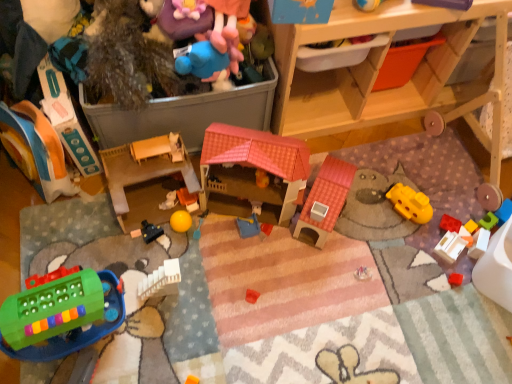
The image size is (512, 384). Identify the location of white matte block at lower right, positioned as the second toy in right-to-left order. (479, 243).

Identify the location of blue plastic toy at center, the ninth toy positioned from the left. (248, 226).

What do you see at coordinates (450, 247) in the screenshot? I see `white plastic toy at lower right, which is counted as the tenth toy, starting from the left` at bounding box center [450, 247].

Find the location of a particular element. Image resolution: width=512 pixels, height=384 pixels. matte plastic toy at left, the second toy viewed from the left is located at coordinates (66, 118).

Measure the distance between point (199,69) and camera.

Point (199,69) and camera are 1.22 meters apart from each other.

The height and width of the screenshot is (384, 512). Describe the element at coordinates (200, 60) in the screenshot. I see `blue plush toy at upper center, the sixth toy positioned from the right` at that location.

Where is `wooden dollhouse at center-left, the tenth toy viewed from the right`? This screenshot has height=384, width=512. wooden dollhouse at center-left, the tenth toy viewed from the right is located at coordinates (145, 167).

This screenshot has height=384, width=512. What do you see at coordinates (145, 167) in the screenshot?
I see `wooden dollhouse at center-left, the 4th toy from the left` at bounding box center [145, 167].

In order to click on smooth orange ball at center, which is the seventh toy in right-to-left order in this screenshot , I will do `click(188, 199)`.

From the image's perspective, which is below, green plastic building block at lower left, positioned as the 11th toy in right-to-left order, or wooden dollhouse at center-left, the 4th toy from the left?

green plastic building block at lower left, positioned as the 11th toy in right-to-left order, appears lower in the image.

Considering the relative sizes of green plastic building block at lower left, which is the 3th toy in left-to-right order, and wooden dollhouse at center-left, the 4th toy from the left, in the image provided, is green plastic building block at lower left, which is the 3th toy in left-to-right order, smaller than wooden dollhouse at center-left, the 4th toy from the left,?

Indeed, green plastic building block at lower left, which is the 3th toy in left-to-right order, has a smaller size compared to wooden dollhouse at center-left, the 4th toy from the left.

Does green plastic building block at lower left, which is the 3th toy in left-to-right order, have a lesser width compared to wooden dollhouse at center-left, the 4th toy from the left?

In fact, green plastic building block at lower left, which is the 3th toy in left-to-right order, might be wider than wooden dollhouse at center-left, the 4th toy from the left.

From a real-world perspective, starting from the green plastic building block at lower left, which is the 3th toy in left-to-right order, which toy is the 1st one below it? Please provide its 2D coordinates.

[(145, 167)]

Does wooden cabinet at upper right have a smaller size compared to matte plastic toy at left, the first toy when ordered from left to right?

Incorrect, wooden cabinet at upper right is not smaller in size than matte plastic toy at left, the first toy when ordered from left to right.

From a real-world perspective, which object rests below the other?

From a 3D spatial view, matte plastic toy at left, positioned as the 13th toy in right-to-left order, is below.

Is wooden cabinet at upper right positioned with its back to matte plastic toy at left, positioned as the 13th toy in right-to-left order?

No, wooden cabinet at upper right is not facing the opposite direction of matte plastic toy at left, positioned as the 13th toy in right-to-left order.

Is wooden cabinet at upper right not near matte plastic toy at left, positioned as the 13th toy in right-to-left order?

No, wooden cabinet at upper right is in close proximity to matte plastic toy at left, positioned as the 13th toy in right-to-left order.

From a real-world perspective, which toy is the 4th one above the white plastic toy at lower right, which is counted as the tenth toy, starting from the left? Please provide its 2D coordinates.

[(169, 201)]

Is smooth plastic toy at center, the ninth toy viewed from the right, facing towards white plastic toy at lower right, positioned as the 4th toy in right-to-left order?

No.

Consider the image. In the image, is smooth plastic toy at center, the ninth toy viewed from the right, on the left side or the right side of white plastic toy at lower right, which is counted as the tenth toy, starting from the left?

From the image, it's evident that smooth plastic toy at center, the ninth toy viewed from the right, is to the left of white plastic toy at lower right, which is counted as the tenth toy, starting from the left.

Looking at this image, can you see smooth plastic toy at center, arranged as the 5th toy when viewed from the left, touching white plastic toy at lower right, positioned as the 4th toy in right-to-left order?

No, smooth plastic toy at center, arranged as the 5th toy when viewed from the left, is not with white plastic toy at lower right, positioned as the 4th toy in right-to-left order.

Identify the location of the 7th toy in front when counting from the smooth orange ball at center, positioned as the 7th toy in left-to-right order. The width and height of the screenshot is (512, 384). click(x=145, y=167).

Is wooden dollhouse at center-left, the tenth toy viewed from the right, placed right next to smooth orange ball at center, positioned as the 7th toy in left-to-right order?

No, wooden dollhouse at center-left, the tenth toy viewed from the right, is not in contact with smooth orange ball at center, positioned as the 7th toy in left-to-right order.

Is wooden dollhouse at center-left, the tenth toy viewed from the right, wider than smooth orange ball at center, which is the seventh toy in right-to-left order?

Yes.

Considering the relative sizes of wooden dollhouse at center-left, the 4th toy from the left, and smooth orange ball at center, positioned as the 7th toy in left-to-right order, in the image provided, is wooden dollhouse at center-left, the 4th toy from the left, bigger than smooth orange ball at center, positioned as the 7th toy in left-to-right order,?

Yes.

Is blue plastic toy at center, the ninth toy positioned from the left, wider than matte plastic toy at left, the first toy when ordered from left to right?

No.

From the image's perspective, is blue plastic toy at center, which is the fifth toy from right to left, located above matte plastic toy at left, positioned as the 13th toy in right-to-left order?

Actually, blue plastic toy at center, which is the fifth toy from right to left, appears below matte plastic toy at left, positioned as the 13th toy in right-to-left order, in the image.

Is point (252, 229) closer or farther from the camera than point (28, 144)?

Point (252, 229) appears to be farther away from the viewer than point (28, 144).

From a real-world perspective, is blue plastic toy at center, which is the fifth toy from right to left, over matte plastic toy at left, the first toy when ordered from left to right?

No, from a real-world perspective, blue plastic toy at center, which is the fifth toy from right to left, is not over matte plastic toy at left, the first toy when ordered from left to right

Is white matte block at lower right, positioned as the second toy in right-to-left order, shorter than translucent plastic cube at center, which is counted as the 13th toy, starting from the left?

No.

Is white matte block at lower right, positioned as the second toy in right-to-left order, bigger or smaller than translucent plastic cube at center, which is counted as the 13th toy, starting from the left?

In the image, white matte block at lower right, positioned as the second toy in right-to-left order, appears to be larger than translucent plastic cube at center, which is counted as the 13th toy, starting from the left.

Is white matte block at lower right, which is the 12th toy in left-to-right order, to the left or to the right of translucent plastic cube at center, the first toy when ordered from right to left, in the image?

Based on their positions, white matte block at lower right, which is the 12th toy in left-to-right order, is located to the left of translucent plastic cube at center, the first toy when ordered from right to left.

From a real-world perspective, between yellow rubber ball at center, the 6th toy from the left, and blue plastic toy at center, the ninth toy positioned from the left, who is vertically higher?

yellow rubber ball at center, the 6th toy from the left, is physically above.

Which is behind, point (186, 228) or point (244, 225)?

The point (244, 225) is farther.

This screenshot has height=384, width=512. I want to click on toy that is the 1st object directly below the green plastic building block at lower left, which is the 3th toy in left-to-right order (from a real-world perspective), so click(x=145, y=167).

Which toy is the 9th one when counting from the left side of the wooden cabinet at upper right? Please provide its 2D coordinates.

[(37, 150)]

Which object lies further to the anchor point smooth orange ball at center, which is the seventh toy in right-to-left order, yellow rubber ball at center, the 6th toy from the left, or blue plastic toy at center, the ninth toy positioned from the left?

The object further to smooth orange ball at center, which is the seventh toy in right-to-left order, is blue plastic toy at center, the ninth toy positioned from the left.

Looking at the image, which one is located closer to matte plastic toy at left, positioned as the 13th toy in right-to-left order, white matte block at lower right, positioned as the second toy in right-to-left order, or green plastic building block at lower left, which is the 3th toy in left-to-right order?

green plastic building block at lower left, which is the 3th toy in left-to-right order, lies closer to matte plastic toy at left, positioned as the 13th toy in right-to-left order, than the other object.

Based on their spatial positions, is blue plastic toy at center, which is the fifth toy from right to left, or translucent plastic cube at center, the first toy when ordered from right to left, closer to smooth orange ball at center, positioned as the 7th toy in left-to-right order?

blue plastic toy at center, which is the fifth toy from right to left, lies closer to smooth orange ball at center, positioned as the 7th toy in left-to-right order, than the other object.

Based on their spatial positions, is wooden cabinet at upper right or translucent plastic cube at center, which is counted as the 13th toy, starting from the left, further from wooden dollhouse at center-left, the tenth toy viewed from the right?

translucent plastic cube at center, which is counted as the 13th toy, starting from the left, lies further to wooden dollhouse at center-left, the tenth toy viewed from the right, than the other object.

In the scene shown: Considering their positions, is smooth plastic toy at center, the ninth toy viewed from the right, positioned closer to translucent plastic cube at center, which is counted as the 13th toy, starting from the left, than green plastic building block at lower left, which is the 3th toy in left-to-right order?

The object closer to translucent plastic cube at center, which is counted as the 13th toy, starting from the left, is smooth plastic toy at center, the ninth toy viewed from the right.

Looking at the image, which one is located closer to matte plastic toy at left, the second toy viewed from the left, wooden cabinet at upper right or blue plush toy at upper center, which is the eighth toy in left-to-right order?

The object closer to matte plastic toy at left, the second toy viewed from the left, is blue plush toy at upper center, which is the eighth toy in left-to-right order.

Considering their positions, is white matte block at lower right, which is the 12th toy in left-to-right order, positioned closer to blue plush toy at upper center, the sixth toy positioned from the right, than matte plastic toy at left, positioned as the 13th toy in right-to-left order?

matte plastic toy at left, positioned as the 13th toy in right-to-left order.

Estimate the real-world distances between objects in this image. Which object is further from translucent orange cube at center, which ranks as the eleventh toy in left-to-right order, blue plastic toy at center, the ninth toy positioned from the left, or wooden cabinet at upper right?

blue plastic toy at center, the ninth toy positioned from the left, is positioned further to the anchor translucent orange cube at center, which ranks as the eleventh toy in left-to-right order.

At what (x,y) coordinates should I click in order to perform the action: click on cabinetry between blue plush toy at upper center, the sixth toy positioned from the right, and white plastic toy at lower right, which is counted as the tenth toy, starting from the left, from left to right. Please return your answer as a coordinate pair (x, y). Looking at the image, I should click on (x=376, y=75).

What are the coordinates of `cabinetry between matte plastic toy at left, the first toy when ordered from left to right, and white matte block at lower right, positioned as the second toy in right-to-left order` in the screenshot? It's located at (376, 75).

Where is `toy between blue plastic toy at center, which is the fifth toy from right to left, and translucent orange cube at center, the 3th toy in the right-to-left sequence, from left to right`? The image size is (512, 384). toy between blue plastic toy at center, which is the fifth toy from right to left, and translucent orange cube at center, the 3th toy in the right-to-left sequence, from left to right is located at coordinates (450, 247).

You are a GUI agent. You are given a task and a screenshot of the screen. Output one action in this format:
    pyautogui.click(x=<x>, y=<y>)
    Task: Click on the cabinetry between green plastic building block at lower left, positioned as the 11th toy in right-to-left order, and translucent plastic cube at center, the first toy when ordered from right to left, in the horizontal direction
    This screenshot has width=512, height=384.
    Given the screenshot: What is the action you would take?
    pyautogui.click(x=376, y=75)